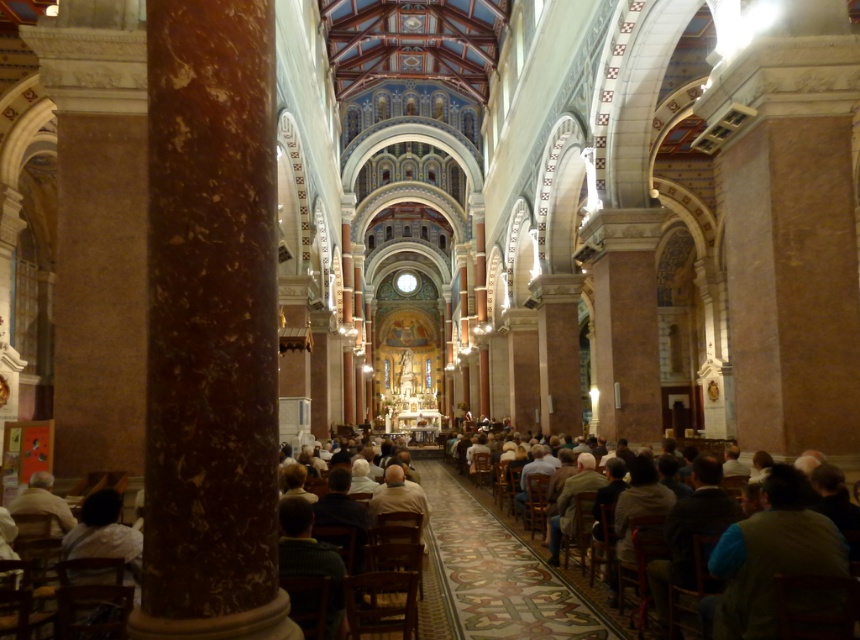
From the picture: Is dark brown leather chair at center smaller than light brown leather jacket at lower left?

No, dark brown leather chair at center is not smaller than light brown leather jacket at lower left.

Which is behind, point (456, 588) or point (62, 509)?

The point (456, 588) is behind.

At what (x,y) coordinates should I click in order to perform the action: click on dark brown leather chair at center. Please return your answer as a coordinate pair (x, y). Image resolution: width=860 pixels, height=640 pixels. Looking at the image, I should click on (468, 524).

Is point (194, 513) positioned behind point (43, 499)?

No, (194, 513) is closer to viewer.

Does point (263, 476) lie in front of point (40, 472)?

Yes, it is in front of point (40, 472).

I want to click on brown marble column at left, so click(210, 324).

What do you see at coordinates (210, 324) in the screenshot?
I see `brown marble column at left` at bounding box center [210, 324].

Does brown marble column at left appear over dark brown leather chair at center?

Yes, brown marble column at left is above dark brown leather chair at center.

Image resolution: width=860 pixels, height=640 pixels. Identify the location of brown marble column at left. (210, 324).

Where is `brown marble column at left`? brown marble column at left is located at coordinates (210, 324).